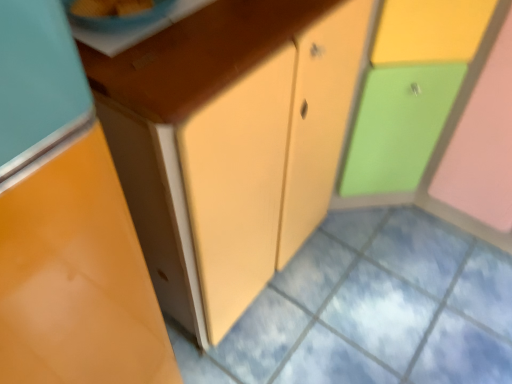
Question: From a real-world perspective, is matte plastic cabinet at right, the 1th cabinetry in the right-to-left sequence, above or below matte yellow cabinet at center?

Choices:
 (A) below
 (B) above

Answer: (B)

Question: Is matte plastic cabinet at right, the 1th cabinetry in the right-to-left sequence, in front of or behind matte yellow cabinet at center in the image?

Choices:
 (A) front
 (B) behind

Answer: (A)

Question: Which object is positioned closest to the matte orange cabinet at left, the first cabinetry viewed from the left?

Choices:
 (A) matte yellow cabinet at center
 (B) matte plastic cabinet at right, the 1th cabinetry in the right-to-left sequence
 (C) blue glossy bowl at upper left

Answer: (C)

Question: Which object is the farthest from the matte yellow cabinet at center?

Choices:
 (A) matte orange cabinet at left, marked as the 2th cabinetry in a right-to-left arrangement
 (B) matte plastic cabinet at right, the 1th cabinetry in the right-to-left sequence
 (C) blue glossy bowl at upper left

Answer: (C)